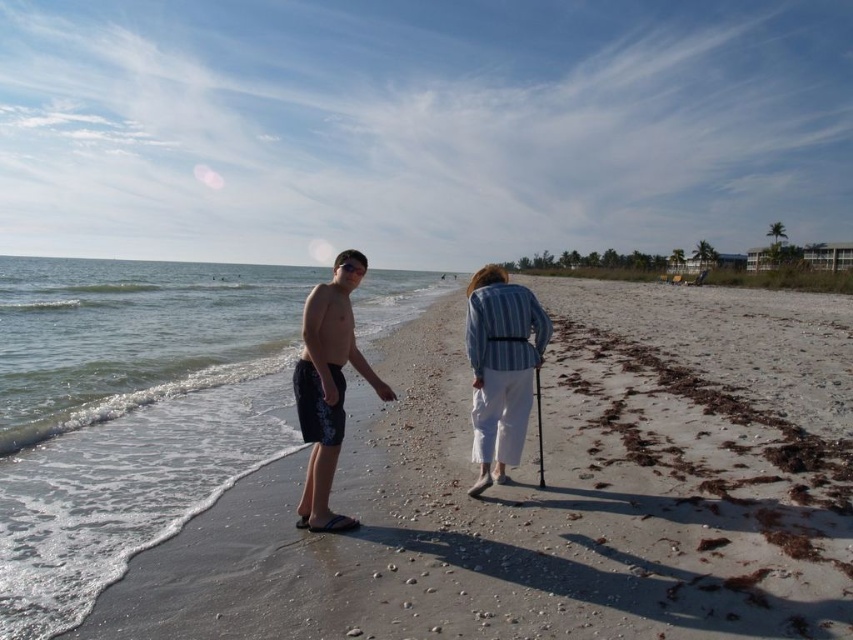
You are standing on the beach and want to place your striped fabric cane at center so it stays upright. Where should you place it relative to the light beige sand at lower left?

The striped fabric cane at center should be placed below the light beige sand at lower left since the light beige sand at lower left is above the striped fabric cane at center.

You are standing at the point marked by the coordinates point (552, 492) in the image. Looking towards the ocean, which direction should you turn to face the person in dark swim trunks and flip flops?

The point (552, 492) indicates light beige sand at lower left. The person in dark swim trunks and flip flops is standing near the water edge facing towards the camera. Since the person is facing the camera, the observer at the point should turn towards the upper right direction to face them.

Based on the photo, you are a photographer trying to capture the beach scene. You notice the light beige sand at lower left and the dark blue swim trunks at left. Which object in the scene has a larger size?

The light beige sand at lower left has a larger size compared to the dark blue swim trunks at left.